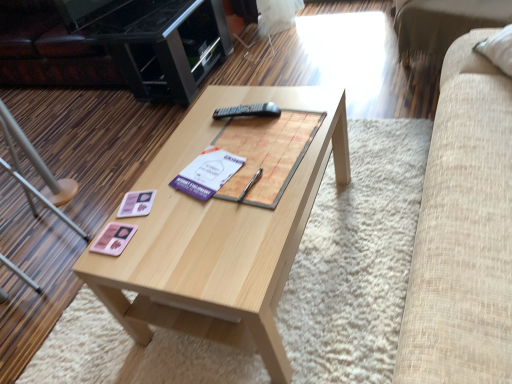
You are a GUI agent. You are given a task and a screenshot of the screen. Output one action in this format:
    pyautogui.click(x=<x>, y=<y>)
    Task: Click on the free space underneath wooden magazine at center (from a real-world perspective)
    The image size is (512, 384).
    Given the screenshot: What is the action you would take?
    pyautogui.click(x=266, y=149)